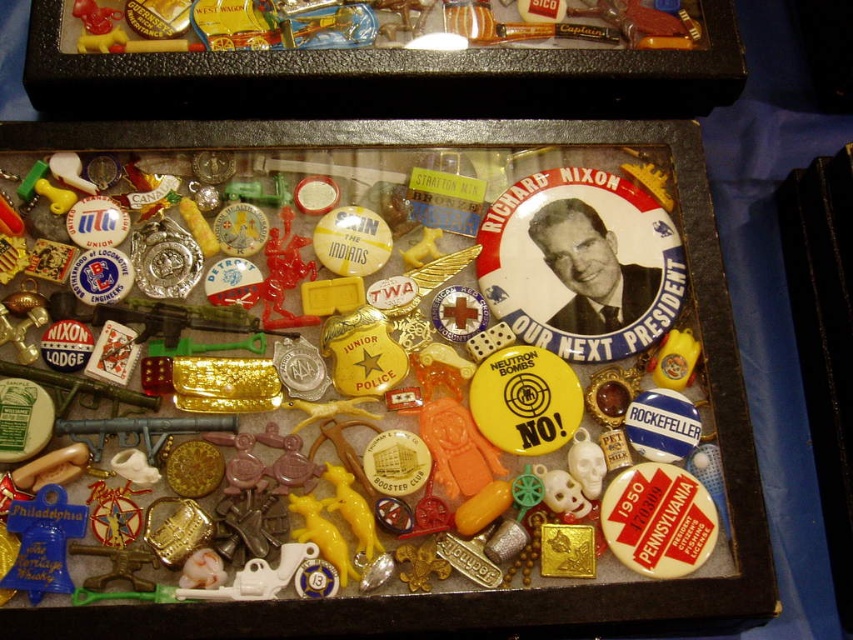
What are the coordinates of the clear plastic box at center?

The clear plastic box at center is located at coordinates point [469,593].